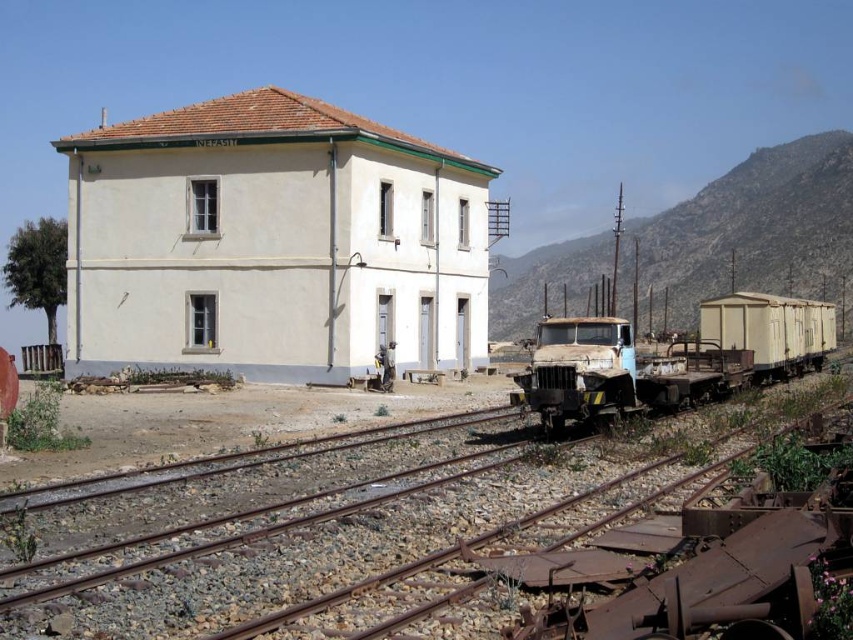
Between rusty metal tracks at center and rusty metal train at center, which one has less height?

With less height is rusty metal tracks at center.

Does rusty metal tracks at center have a greater width compared to rusty metal train at center?

In fact, rusty metal tracks at center might be narrower than rusty metal train at center.

What do you see at coordinates (453, 538) in the screenshot?
I see `rusty metal tracks at center` at bounding box center [453, 538].

Where is `rusty metal tracks at center`? Image resolution: width=853 pixels, height=640 pixels. rusty metal tracks at center is located at coordinates (453, 538).